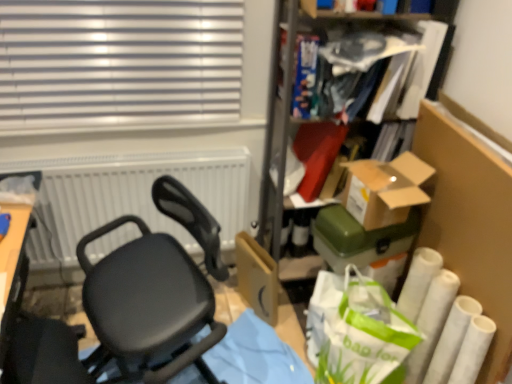
What do you see at coordinates (356, 330) in the screenshot?
I see `green paper shopping bag at lower right` at bounding box center [356, 330].

Where is `green paper shopping bag at lower right`? green paper shopping bag at lower right is located at coordinates coord(356,330).

What do you see at coordinates (131, 196) in the screenshot? Image resolution: width=512 pixels, height=384 pixels. I see `white matte radiator at upper left` at bounding box center [131, 196].

Image resolution: width=512 pixels, height=384 pixels. I want to click on brown cardboard box at upper right, which is counted as the first box, starting from the top, so click(385, 189).

Measure the distance between point (269, 311) and camera.

6.01 feet.

How much space does green matte box at center-right, the first box when ordered from bottom to top, occupy horizontally?

green matte box at center-right, the first box when ordered from bottom to top, is 14.10 inches in width.

Locate an element on the screen. The height and width of the screenshot is (384, 512). matte black book at upper right, the first book from the right is located at coordinates (368, 63).

Find the location of `green paper shopping bag at lower right`. green paper shopping bag at lower right is located at coordinates (356, 330).

Find the location of a particular element. This screenshot has height=384, width=512. cardboard box below the white matte radiator at upper left (from the image's perspective) is located at coordinates (257, 277).

In the image, is cardboard box at center positioned in front of or behind white matte radiator at upper left?

Clearly, cardboard box at center is behind white matte radiator at upper left.

How different are the orientations of cardboard box at center and white matte radiator at upper left in degrees?

They differ by 74.7 degrees in their facing directions.

Is point (270, 298) closer to viewer compared to point (41, 258)?

Yes, it is.

In terms of width, does blue paperback book at upper right, which appears as the first book when viewed from the left, look wider or thinner when compared to green paper shopping bag at lower right?

Considering their sizes, blue paperback book at upper right, which appears as the first book when viewed from the left, looks slimmer than green paper shopping bag at lower right.

Is blue paperback book at upper right, which ranks as the 2th book in right-to-left order, at the left side of green paper shopping bag at lower right?

Indeed, blue paperback book at upper right, which ranks as the 2th book in right-to-left order, is positioned on the left side of green paper shopping bag at lower right.

From a real-world perspective, does blue paperback book at upper right, which ranks as the 2th book in right-to-left order, stand above green paper shopping bag at lower right?

Yes, from a real-world perspective, blue paperback book at upper right, which ranks as the 2th book in right-to-left order, is above green paper shopping bag at lower right.

From the image's perspective, is blue paperback book at upper right, which ranks as the 2th book in right-to-left order, under green paper shopping bag at lower right?

Actually, blue paperback book at upper right, which ranks as the 2th book in right-to-left order, appears above green paper shopping bag at lower right in the image.

Is green paper shopping bag at lower right located outside blue paperback book at upper right, which appears as the first book when viewed from the left?

green paper shopping bag at lower right is positioned outside blue paperback book at upper right, which appears as the first book when viewed from the left.

Could you tell me if green paper shopping bag at lower right is turned towards blue paperback book at upper right, which appears as the first book when viewed from the left?

No, green paper shopping bag at lower right is not aimed at blue paperback book at upper right, which appears as the first book when viewed from the left.

Where is `shopping bag that appears below the blue paperback book at upper right, which ranks as the 2th book in right-to-left order (from a real-world perspective)`? The height and width of the screenshot is (384, 512). shopping bag that appears below the blue paperback book at upper right, which ranks as the 2th book in right-to-left order (from a real-world perspective) is located at coordinates (356, 330).

Does point (409, 346) come closer to viewer compared to point (306, 103)?

Yes, point (409, 346) is in front of point (306, 103).

Which of these two, matte black book at upper right, which appears as the 2th book when viewed from the left, or green paper shopping bag at lower right, is thinner?

With smaller width is matte black book at upper right, which appears as the 2th book when viewed from the left.

Can you confirm if matte black book at upper right, which appears as the 2th book when viewed from the left, is shorter than green paper shopping bag at lower right?

Yes, matte black book at upper right, which appears as the 2th book when viewed from the left, is shorter than green paper shopping bag at lower right.

From the image's perspective, which is above, matte black book at upper right, the first book from the right, or green paper shopping bag at lower right?

From the image's view, matte black book at upper right, the first book from the right, is above.

At what (x,y) coordinates should I click in order to perform the action: click on cardboard box lying behind the green matte box at center-right, the 2th box from the top. Please return your answer as a coordinate pair (x, y). This screenshot has height=384, width=512. Looking at the image, I should click on (257, 277).

Is cardboard box at center next to green matte box at center-right, the first box when ordered from bottom to top, and touching it?

No, cardboard box at center is not in contact with green matte box at center-right, the first box when ordered from bottom to top.

Does point (267, 279) come in front of point (337, 220)?

No, (267, 279) is behind (337, 220).

Which of these two, matte black book at upper right, which appears as the 2th book when viewed from the left, or white matte radiator at upper left, is wider?

matte black book at upper right, which appears as the 2th book when viewed from the left, is wider.

Which object is closer to the camera taking this photo, matte black book at upper right, the first book from the right, or white matte radiator at upper left?

matte black book at upper right, the first book from the right, is in front.

From the picture: What's the angular difference between matte black book at upper right, the first book from the right, and white matte radiator at upper left's facing directions?

4.61 degrees.

Is matte black book at upper right, which appears as the 2th book when viewed from the left, oriented towards white matte radiator at upper left?

No, matte black book at upper right, which appears as the 2th book when viewed from the left, is not turned towards white matte radiator at upper left.

Based on the photo, does green paper shopping bag at lower right have a smaller size compared to black matte chair at center?

Yes.

At what (x,y) coordinates should I click in order to perform the action: click on chair in front of the green paper shopping bag at lower right. Please return your answer as a coordinate pair (x, y). This screenshot has height=384, width=512. Looking at the image, I should click on (146, 305).

Does green paper shopping bag at lower right appear on the right side of black matte chair at center?

Yes, green paper shopping bag at lower right is to the right of black matte chair at center.

From the image's perspective, relative to black matte chair at center, is green paper shopping bag at lower right above or below?

From the image's perspective, green paper shopping bag at lower right appears below black matte chair at center.

Find the location of a particular element. The height and width of the screenshot is (384, 512). radiator above the cardboard box at center (from a real-world perspective) is located at coordinates (131, 196).

Locate an element on the screen. shopping bag on the right of blue paperback book at upper right, which ranks as the 2th book in right-to-left order is located at coordinates (356, 330).

Estimate the real-world distances between objects in this image. Which object is closer to green matte box at center-right, the first box when ordered from bottom to top, blue paperback book at upper right, which appears as the first book when viewed from the left, or white matte radiator at upper left?

Among the two, blue paperback book at upper right, which appears as the first book when viewed from the left, is located nearer to green matte box at center-right, the first box when ordered from bottom to top.

From the image, which object appears to be farther from green paper shopping bag at lower right, cardboard box at center or black matte chair at center?

Based on the image, black matte chair at center appears to be further to green paper shopping bag at lower right.

From the image, which object appears to be nearer to cardboard box at center, green matte box at center-right, the first box when ordered from bottom to top, or green paper shopping bag at lower right?

The object closer to cardboard box at center is green paper shopping bag at lower right.

When comparing their distances from cardboard box at center, does green paper shopping bag at lower right or brown cardboard box at upper right, which is counted as the first box, starting from the top, seem further?

Based on the image, brown cardboard box at upper right, which is counted as the first box, starting from the top, appears to be further to cardboard box at center.

When comparing their distances from white matte radiator at upper left, does blue paperback book at upper right, which ranks as the 2th book in right-to-left order, or green paper shopping bag at lower right seem further?

green paper shopping bag at lower right is further to white matte radiator at upper left.

From the image, which object appears to be farther from green matte box at center-right, the 2th box from the top, white matte radiator at upper left or brown cardboard box at upper right, which ranks as the 2th box in bottom-to-top order?

Based on the image, white matte radiator at upper left appears to be further to green matte box at center-right, the 2th box from the top.

Which object lies nearer to the anchor point white matte radiator at upper left, blue paperback book at upper right, which ranks as the 2th book in right-to-left order, or cardboard box at center?

cardboard box at center is closer to white matte radiator at upper left.

Considering their positions, is matte black book at upper right, which appears as the 2th book when viewed from the left, positioned closer to black matte chair at center than blue paperback book at upper right, which appears as the first book when viewed from the left?

blue paperback book at upper right, which appears as the first book when viewed from the left, is positioned closer to the anchor black matte chair at center.

This screenshot has width=512, height=384. What are the coordinates of `box between brown cardboard box at upper right, which is counted as the first box, starting from the top, and green paper shopping bag at lower right from top to bottom` in the screenshot? It's located at (359, 238).

At what (x,y) coordinates should I click in order to perform the action: click on book between blue paperback book at upper right, which ranks as the 2th book in right-to-left order, and cardboard box at center in the up-down direction. Please return your answer as a coordinate pair (x, y). Image resolution: width=512 pixels, height=384 pixels. Looking at the image, I should click on (368, 63).

Identify the location of book between blue paperback book at upper right, which appears as the first book when viewed from the left, and green matte box at center-right, the 2th box from the top, from top to bottom. The image size is (512, 384). (368, 63).

The image size is (512, 384). Find the location of `box between matte black book at upper right, which appears as the 2th book when viewed from the left, and green matte box at center-right, the first box when ordered from bottom to top, from top to bottom`. box between matte black book at upper right, which appears as the 2th book when viewed from the left, and green matte box at center-right, the first box when ordered from bottom to top, from top to bottom is located at coordinates (385, 189).